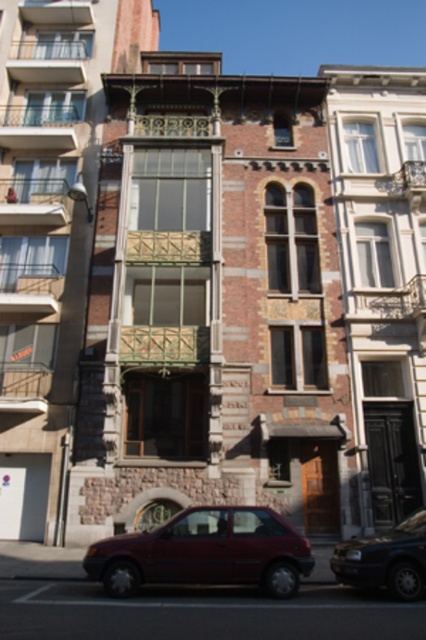
Who is shorter, metallic car at lower center or dark blue metallic car at lower right?

With less height is dark blue metallic car at lower right.

Can you confirm if metallic car at lower center is bigger than dark blue metallic car at lower right?

Yes, metallic car at lower center is bigger than dark blue metallic car at lower right.

This screenshot has width=426, height=640. In order to click on metallic car at lower center in this screenshot , I will do `click(201, 612)`.

This screenshot has width=426, height=640. I want to click on metallic car at lower center, so click(x=201, y=612).

In the scene shown: Between metallic car at lower center and matte red car at lower center, which one has more height?

metallic car at lower center is taller.

Which is above, metallic car at lower center or matte red car at lower center?

matte red car at lower center is above.

Is point (175, 624) closer to camera compared to point (117, 556)?

Yes.

This screenshot has height=640, width=426. Find the location of `metallic car at lower center`. metallic car at lower center is located at coordinates [201, 612].

Is the position of matte red car at lower center more distant than that of dark blue metallic car at lower right?

Yes.

Which is below, matte red car at lower center or dark blue metallic car at lower right?

dark blue metallic car at lower right is below.

Between point (230, 536) and point (393, 529), which one is positioned behind?

The point (393, 529) is behind.

Locate an element on the screen. The width and height of the screenshot is (426, 640). matte red car at lower center is located at coordinates (204, 552).